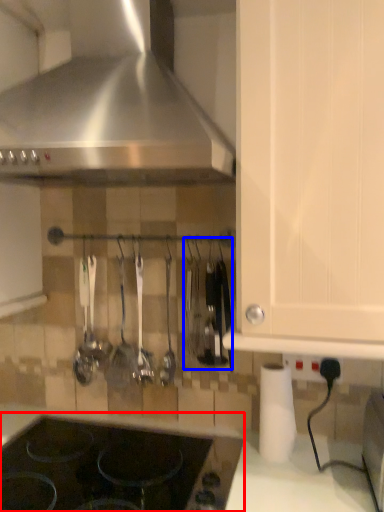
Question: Which object is further to the camera taking this photo, gas stove (highlighted by a red box) or cutlery (highlighted by a blue box)?

Choices:
 (A) gas stove
 (B) cutlery

Answer: (B)